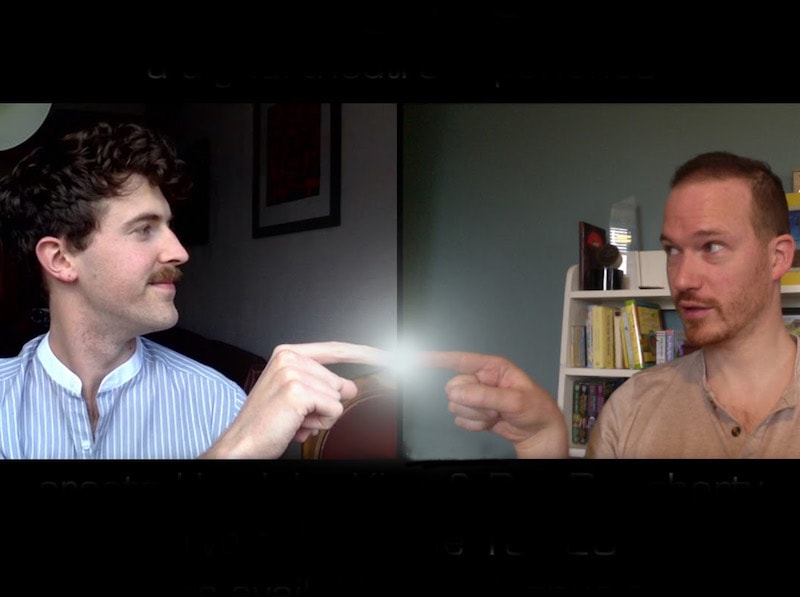
Locate an element on the screen. This screenshot has height=597, width=800. second shelf from the top is located at coordinates (598, 374).